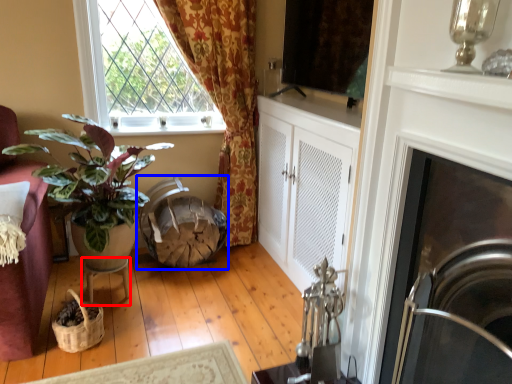
Question: Which object appears closest to the camera in this image, table (highlighted by a red box) or swivel chair (highlighted by a blue box)?

Choices:
 (A) table
 (B) swivel chair

Answer: (A)